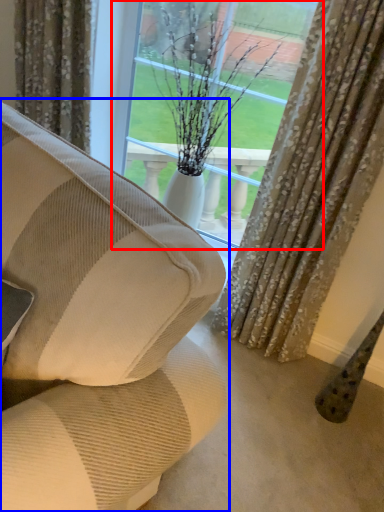
Question: Among these objects, which one is farthest to the camera, window (highlighted by a red box) or studio couch (highlighted by a blue box)?

Choices:
 (A) window
 (B) studio couch

Answer: (A)